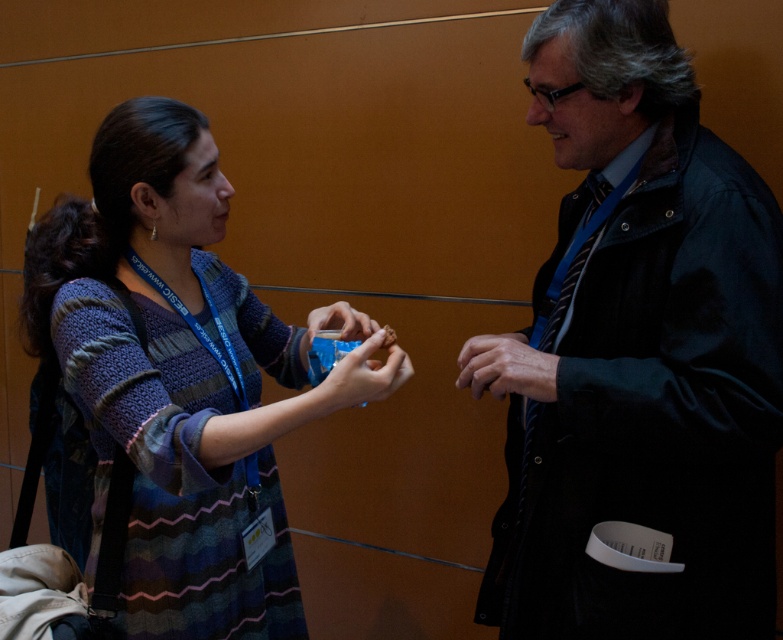
Does dry skin at center have a smaller size compared to matte plastic cookie at center?

Indeed, dry skin at center has a smaller size compared to matte plastic cookie at center.

Who is shorter, dry skin at center or matte plastic cookie at center?

dry skin at center

Measure the distance between point (477, 387) and camera.

A distance of 1.25 meters exists between point (477, 387) and camera.

Locate an element on the screen. dry skin at center is located at coordinates (507, 368).

Who is positioned more to the left, knitted sweater at center or matte plastic cookie at center?

knitted sweater at center is more to the left.

Can you confirm if knitted sweater at center is taller than matte plastic cookie at center?

Indeed, knitted sweater at center has a greater height compared to matte plastic cookie at center.

Does point (31, 301) come closer to viewer compared to point (352, 346)?

Yes, it is.

At what (x,y) coordinates should I click in order to perform the action: click on knitted sweater at center. Please return your answer as a coordinate pair (x, y). This screenshot has width=783, height=640. Looking at the image, I should click on (179, 378).

Who is higher up, dark blue jacket at center or dry skin at center?

dark blue jacket at center is above.

Does dark blue jacket at center appear on the right side of dry skin at center?

Indeed, dark blue jacket at center is positioned on the right side of dry skin at center.

Between point (619, 449) and point (489, 333), which one is positioned in front?

Point (619, 449)

Locate an element on the screen. dark blue jacket at center is located at coordinates (643, 353).